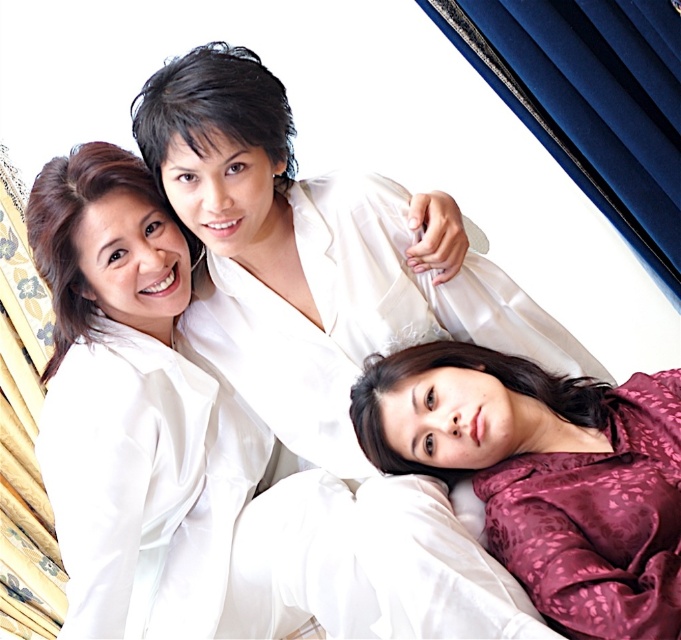
Who is higher up, white satin shirt at center or silky purple pajamas at lower right?

white satin shirt at center is higher up.

What do you see at coordinates (308, 259) in the screenshot?
I see `white satin shirt at center` at bounding box center [308, 259].

What are the coordinates of `white satin shirt at center` in the screenshot? It's located at (308, 259).

Identify the location of white satin shirt at center. coord(308,259).

Is point (409, 561) positioned in front of point (665, 493)?

No, (409, 561) is further to viewer.

Between silky purple robe at center and silky purple pajamas at lower right, which one has more height?

Standing taller between the two is silky purple robe at center.

What do you see at coordinates (355, 378) in the screenshot? I see `silky purple robe at center` at bounding box center [355, 378].

Where is `silky purple robe at center`? The width and height of the screenshot is (681, 640). silky purple robe at center is located at coordinates (355, 378).

Is point (415, 545) less distant than point (59, 452)?

Yes, point (415, 545) is closer to viewer.

Is silky purple robe at center taller than matte white shirt at upper left?

No, silky purple robe at center is not taller than matte white shirt at upper left.

Where is `silky purple robe at center`? Image resolution: width=681 pixels, height=640 pixels. silky purple robe at center is located at coordinates (355, 378).